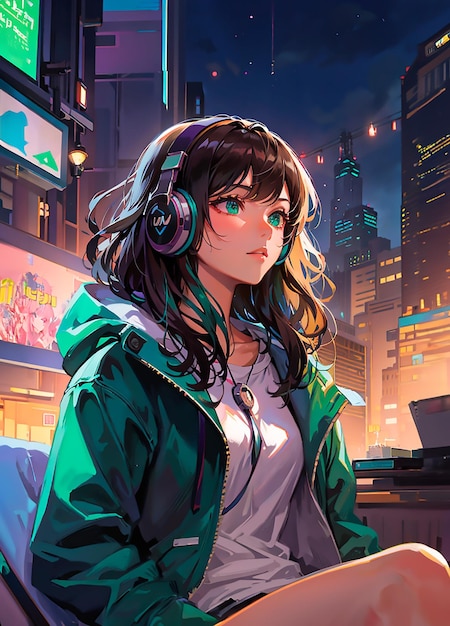
The height and width of the screenshot is (626, 450). In order to click on chair back in this screenshot , I will do coord(12,493).